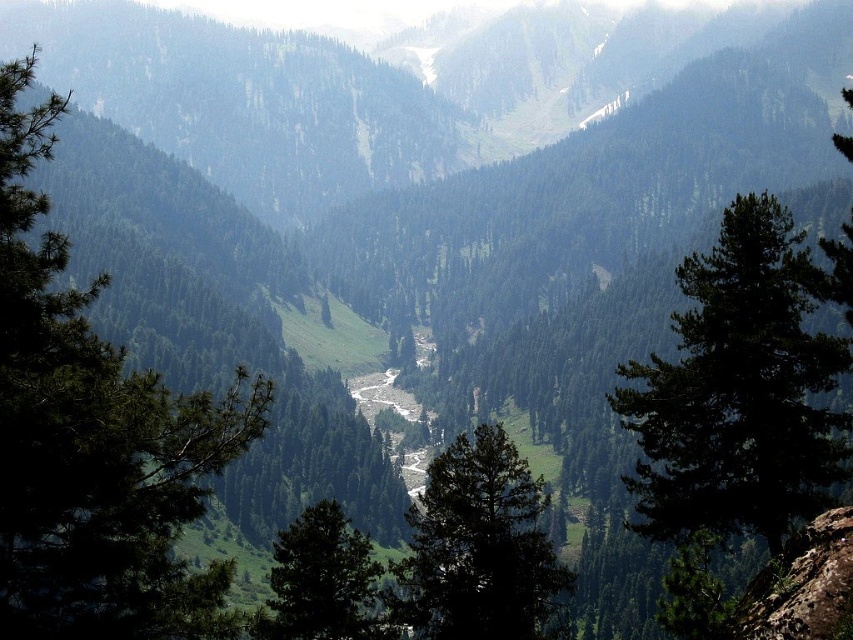
Between green textured tree at center and green matte tree at right, which one appears on the left side from the viewer's perspective?

From the viewer's perspective, green textured tree at center appears more on the left side.

Between green textured tree at center and green matte tree at right, which one has less height?

green matte tree at right

Which is in front, point (33, 554) or point (759, 513)?

Point (33, 554) is in front.

Image resolution: width=853 pixels, height=640 pixels. Identify the location of green textured tree at center. (94, 440).

Does green matte tree at right lie behind green matte tree at center?

No.

Which is behind, point (801, 506) or point (351, 586)?

Positioned behind is point (351, 586).

Find the location of a particular element. The width and height of the screenshot is (853, 640). green matte tree at right is located at coordinates (740, 390).

Which is in front, point (724, 499) or point (535, 492)?

Point (724, 499) is more forward.

I want to click on green matte tree at right, so click(x=740, y=390).

At what (x,y) coordinates should I click in order to perform the action: click on green matte tree at right. Please return your answer as a coordinate pair (x, y). The width and height of the screenshot is (853, 640). Looking at the image, I should click on (740, 390).